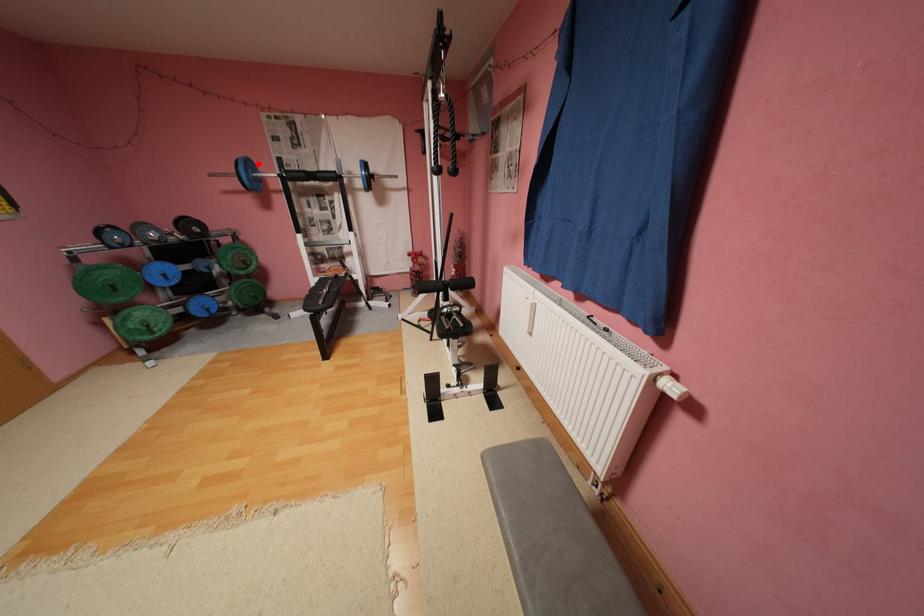
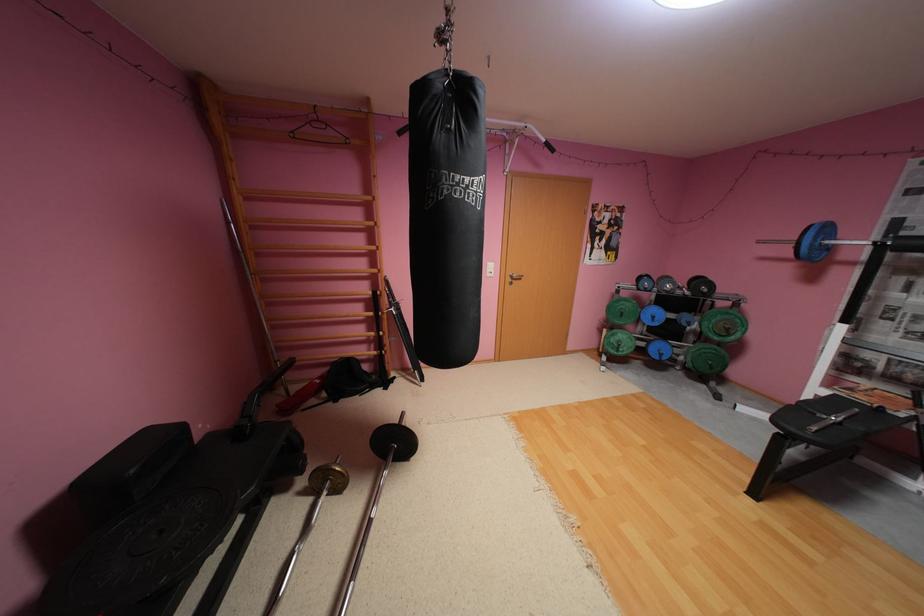
Question: I am providing you with two images of the same scene from different viewpoints. Image1 has a red point marked. In image2, the corresponding 3D location appears at what relative position? Reply with the corresponding letter.

Choices:
 (A) Closer
 (B) Farther

Answer: (B)